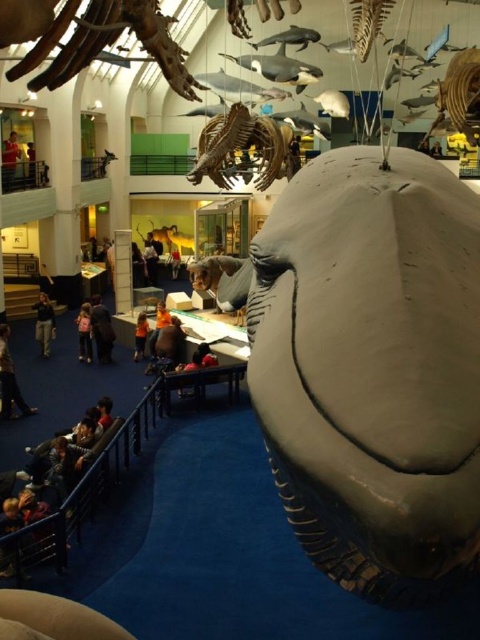
Question: Which point appears closest to the camera in this image?

Choices:
 (A) (59, 72)
 (B) (92, 321)
 (C) (80, 333)
 (D) (41, 336)

Answer: (A)

Question: Is dark brown leather jacket at lower left to the left of dark brown fur at center from the viewer's perspective?

Choices:
 (A) yes
 (B) no

Answer: (A)

Question: Can you confirm if smooth gray dinosaur at upper center is thinner than orange fabric shirt at center?

Choices:
 (A) yes
 (B) no

Answer: (B)

Question: Which point is closer to the camera?

Choices:
 (A) shiny metallic dinosaur skeleton at center
 (B) orange fabric shirt at center

Answer: (A)

Question: Is dark brown fur at center positioned behind dark gray fabric jacket at lower left?

Choices:
 (A) yes
 (B) no

Answer: (B)

Question: Estimate the real-world distances between objects in this image. Which object is closer to the dark brown leather jacket at center?

Choices:
 (A) pink fabric at lower center
 (B) orange fabric shirt at center
 (C) dark brown leather jacket at upper center
 (D) dark gray fabric jacket at lower left

Answer: (B)